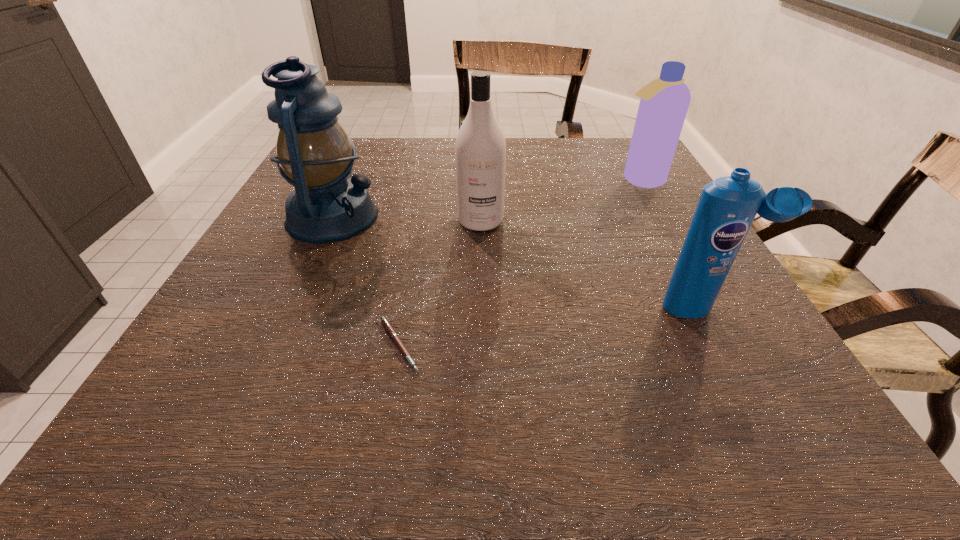
Image resolution: width=960 pixels, height=540 pixels. I want to click on the leftmost object, so click(x=314, y=153).

The height and width of the screenshot is (540, 960). What are the coordinates of `the third object from right to left` in the screenshot? It's located at (480, 150).

Locate an element on the screen. The width and height of the screenshot is (960, 540). the second nearest shampoo is located at coordinates (480, 150).

Locate an element on the screen. This screenshot has width=960, height=540. the farthest shampoo is located at coordinates (664, 102).

Locate an element on the screen. This screenshot has height=540, width=960. the nearest shampoo is located at coordinates (727, 207).

Locate an element on the screen. the shortest object is located at coordinates (385, 322).

Where is `the fourth object from right to left`? This screenshot has height=540, width=960. the fourth object from right to left is located at coordinates (385, 322).

Where is `free space located on the face of the leftmost object`? Image resolution: width=960 pixels, height=540 pixels. free space located on the face of the leftmost object is located at coordinates (452, 217).

The height and width of the screenshot is (540, 960). In order to click on blank area located 0.190m on the front-facing side of the third object from left to right in this screenshot , I will do click(x=481, y=299).

In order to click on vacant position located 0.140m on the back of the farthest shampoo in this screenshot , I will do `click(620, 145)`.